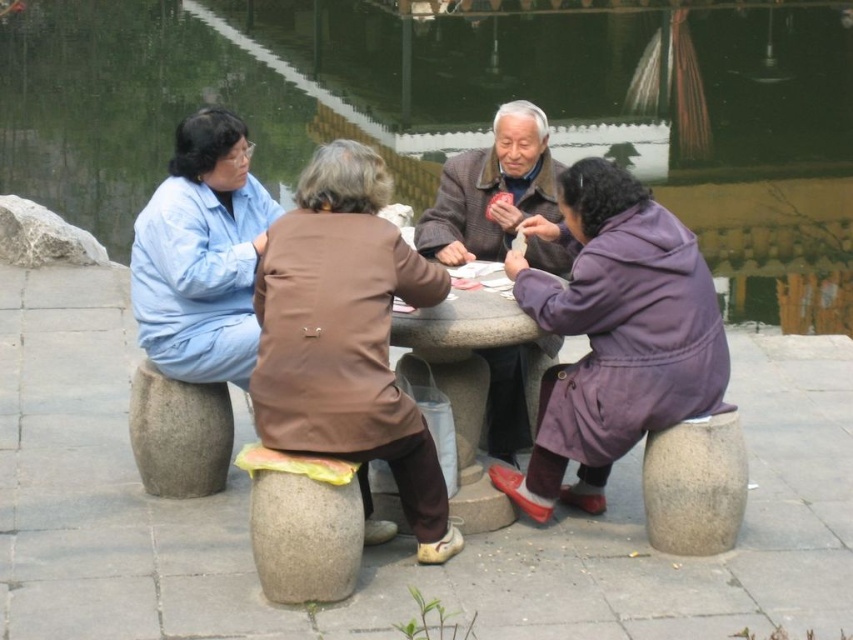
Can you confirm if brown leather jacket at center is smaller than brown woolen coat at center?

Actually, brown leather jacket at center might be larger than brown woolen coat at center.

Which is above, brown leather jacket at center or brown woolen coat at center?

brown woolen coat at center

Which is in front, point (404, 410) or point (503, 449)?

Positioned in front is point (404, 410).

Identify the location of brown leather jacket at center. (347, 339).

Between light blue fabric at left and brown woolen coat at center, which one is positioned higher?

brown woolen coat at center

Which is below, light blue fabric at left or brown woolen coat at center?

Positioned lower is light blue fabric at left.

Between point (165, 333) and point (531, 152), which one is positioned in front?

Positioned in front is point (165, 333).

At what (x,y) coordinates should I click in order to perform the action: click on light blue fabric at left. Please return your answer as a coordinate pair (x, y). Looking at the image, I should click on (201, 253).

Is purple woolen coat at lower right bigger than brown woolen coat at center?

Yes.

Between purple woolen coat at lower right and brown woolen coat at center, which one has more height?

With more height is purple woolen coat at lower right.

Who is more distant from viewer, (x=555, y=465) or (x=469, y=161)?

The point (x=469, y=161) is more distant.

Where is `purple woolen coat at lower right`? purple woolen coat at lower right is located at coordinates (614, 333).